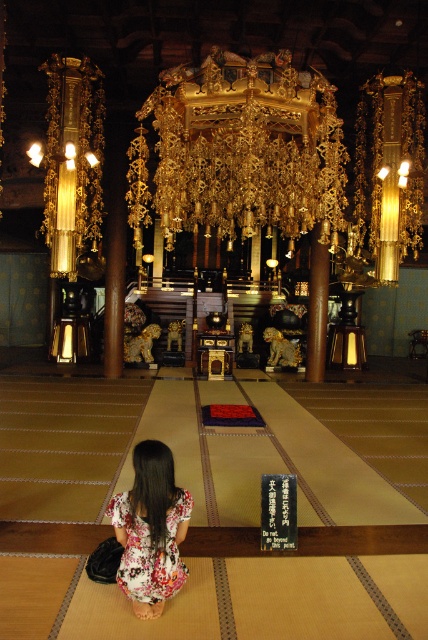
You are standing at the entrance of the temple and want to approach the golden altar at the back. There is a red and black mat on a low platform in front of the altar. If you start moving straight towards the golden altar from your current position, will you pass through the point labeled as point [317,81] before reaching the altar?

The distance between point [317,81] and the viewer is 22.09 feet. Since the point is along the path towards the golden altar, you will pass through point [317,81] before reaching the altar.

You are a visitor standing at the entrance of the temple. You see the gold metallic chandelier at center and the floral fabric dress at lower center. Which object is closer to you?

The gold metallic chandelier at center is closer to you because it is further to the viewer than the floral fabric dress at lower center.

You are a visitor standing at the entrance of the temple. You see the gold metallic chandelier at center and the floral fabric dress at lower center. Which object is positioned to the right side from your perspective?

The gold metallic chandelier at center is to the right of the floral fabric dress at lower center, so the chandelier is positioned to the right side from your perspective.